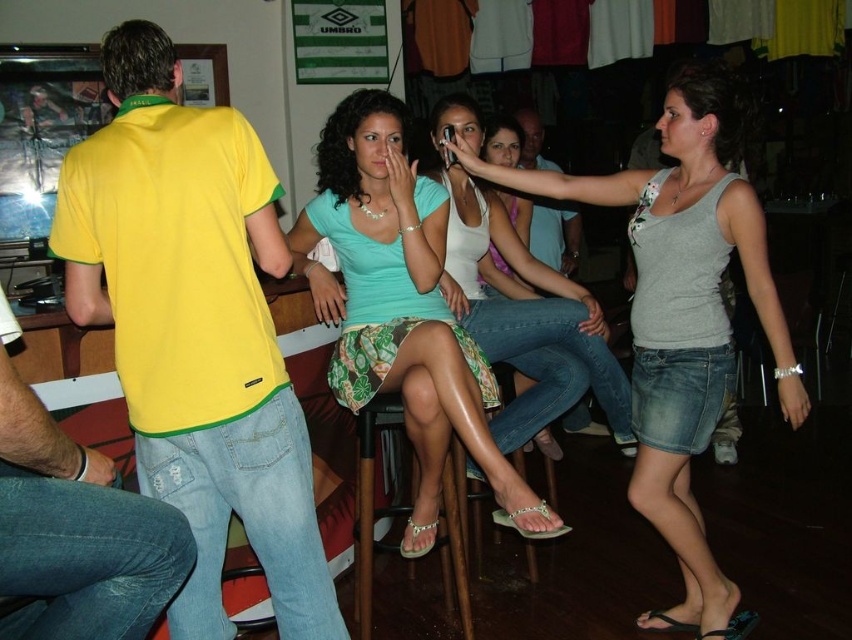
This screenshot has height=640, width=852. I want to click on jeans at left, so click(76, 529).

Is jeans at left taller than matte white tank top at center?

No, jeans at left is not taller than matte white tank top at center.

In the scene shown: Who is more forward, (x=16, y=554) or (x=559, y=308)?

Point (x=16, y=554)

You are a GUI agent. You are given a task and a screenshot of the screen. Output one action in this format:
    pyautogui.click(x=<x>, y=<y>)
    Task: Click on the jeans at left
    
    Given the screenshot: What is the action you would take?
    pyautogui.click(x=76, y=529)

Between yellow cotton shirt at left and jeans at left, which one has more height?

Standing taller between the two is yellow cotton shirt at left.

The height and width of the screenshot is (640, 852). What do you see at coordinates (194, 328) in the screenshot?
I see `yellow cotton shirt at left` at bounding box center [194, 328].

Between point (142, 209) and point (3, 454), which one is positioned behind?

Positioned behind is point (142, 209).

The height and width of the screenshot is (640, 852). Find the location of `yellow cotton shirt at left`. yellow cotton shirt at left is located at coordinates (194, 328).

From the picture: Measure the distance between light green fabric skirt at center and camera.

They are 6.51 feet apart.

Is point (372, 132) positioned in front of point (453, 512)?

Yes, point (372, 132) is closer to viewer.

Find the location of a particular element. Image resolution: width=852 pixels, height=640 pixels. light green fabric skirt at center is located at coordinates (401, 307).